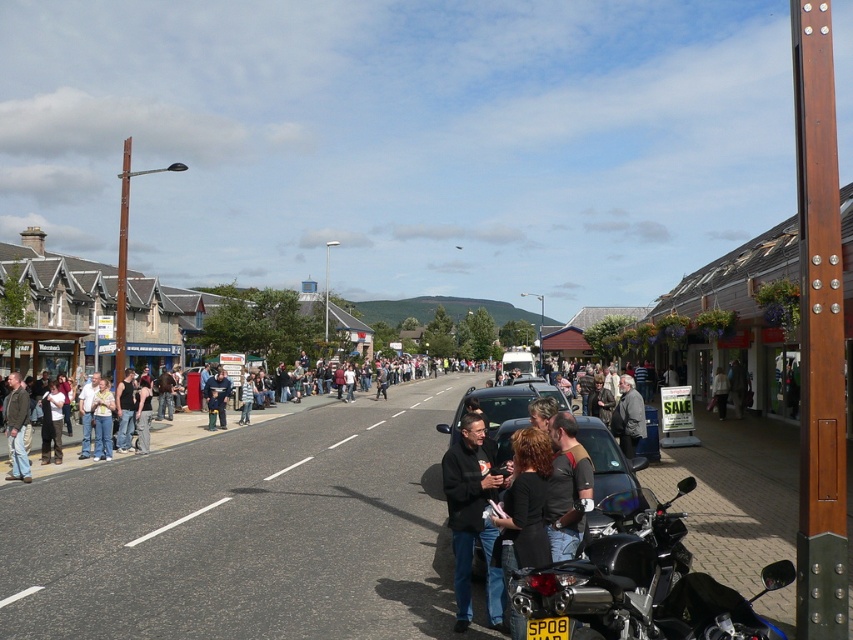
You are a photographer trying to capture a candid shot of the light brown leather jacket at center without including the dark gray jacket at center in the frame. Is this possible given their positions?

The dark gray jacket at center is in front of the light brown leather jacket at center, so it would block the view. Therefore, you cannot capture the light brown leather jacket at center without including the dark gray jacket at center in the frame.

You are a photographer taking a photo of the street scene. You notice two groups of people wearing denim jeans at left and jeans at center. Which group of jeans is taller?

The denim jeans at left has a greater height compared to jeans at center, so the group wearing denim jeans at left is taller.